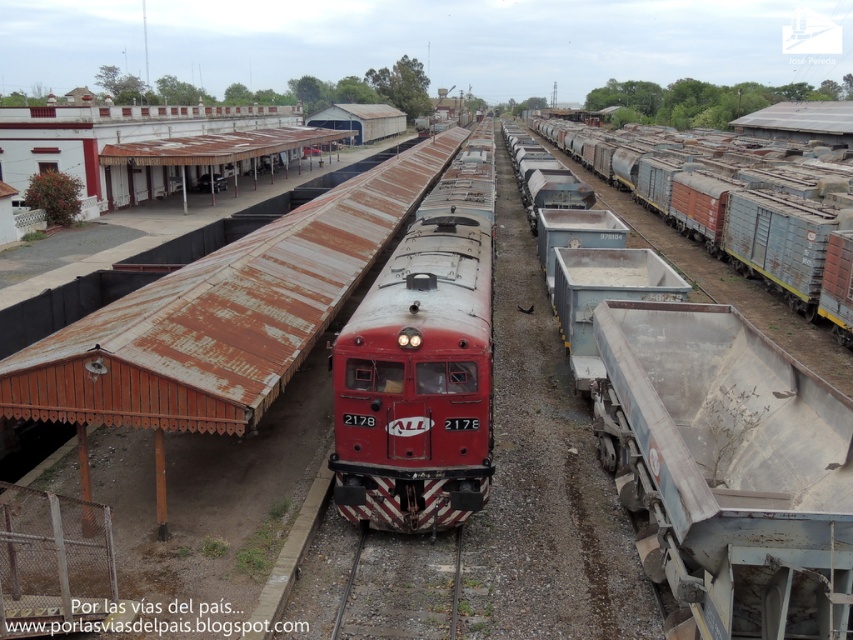
You are standing at the center of the image and want to locate the rusty metal freight car at center. What are the coordinates where you should look?

The coordinates to locate the rusty metal freight car at center are at point (717, 204).

You are standing at the origin point of the coordinate system in the railway yard. Where is the red matte locomotive at center located?

The red matte locomotive at center is located at point (422,364).

You are a railway inspector checking the layout of the yard. The safety regulations state that the locomotive must not exceed the track width to ensure proper alignment. Given the red matte locomotive at center and the gray gravel train track at center, is the current setup compliant with safety standards?

The red matte locomotive at center is wider than the gray gravel train track at center, so the setup is not compliant with safety standards as the locomotive exceeds the track width.